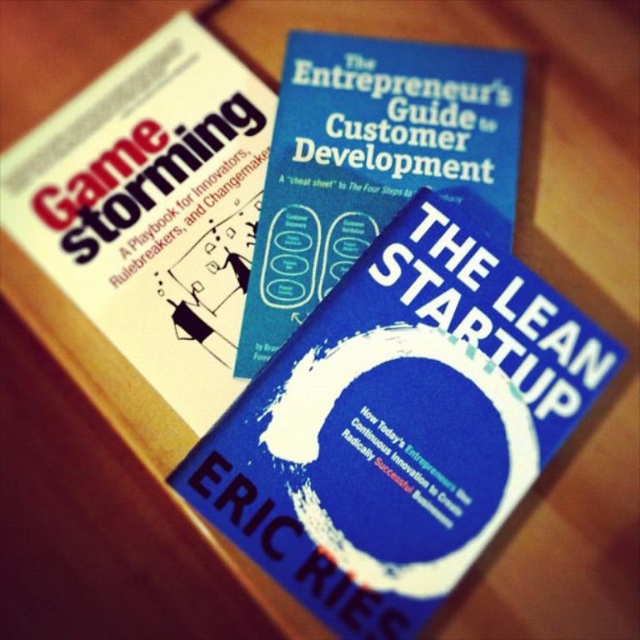
Does white paper book cover at upper left have a larger size compared to blue matte book at center?

Indeed, white paper book cover at upper left has a larger size compared to blue matte book at center.

Does white paper book cover at upper left lie behind blue matte book at center?

No.

Between point (124, 70) and point (433, 60), which one is positioned behind?

The point (124, 70) is more distant.

At what (x,y) coordinates should I click in order to perform the action: click on white paper book cover at upper left. Please return your answer as a coordinate pair (x, y). Image resolution: width=640 pixels, height=640 pixels. Looking at the image, I should click on (152, 209).